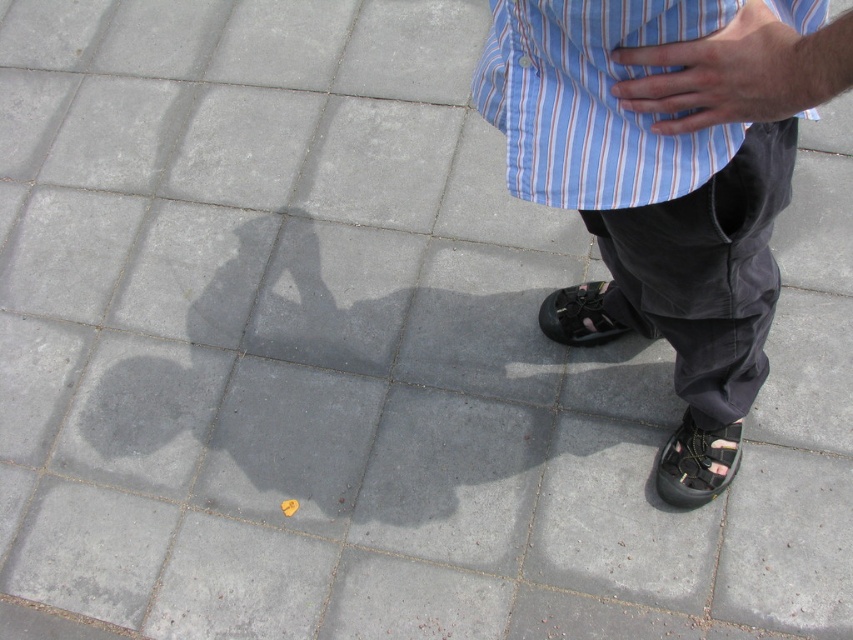
Can you confirm if smooth skin hand at center is positioned above black leather shoe at lower right?

Yes, smooth skin hand at center is above black leather shoe at lower right.

Does smooth skin hand at center have a greater width compared to black leather shoe at lower right?

Correct, the width of smooth skin hand at center exceeds that of black leather shoe at lower right.

Find the location of `smooth skin hand at center`. smooth skin hand at center is located at coordinates (738, 72).

Is point (651, 291) positioned after point (735, 426)?

No.

Is the position of matte black sandals at lower right more distant than that of black leather shoe at lower right?

No, matte black sandals at lower right is closer to the viewer.

Is point (641, 188) in front of point (670, 435)?

That is True.

Where is `matte black sandals at lower right`? Image resolution: width=853 pixels, height=640 pixels. matte black sandals at lower right is located at coordinates (647, 180).

Which is more to the left, blue striped shirt at center or black leather shoe at lower center?

From the viewer's perspective, blue striped shirt at center appears more on the left side.

Image resolution: width=853 pixels, height=640 pixels. Describe the element at coordinates (593, 100) in the screenshot. I see `blue striped shirt at center` at that location.

This screenshot has width=853, height=640. I want to click on blue striped shirt at center, so click(593, 100).